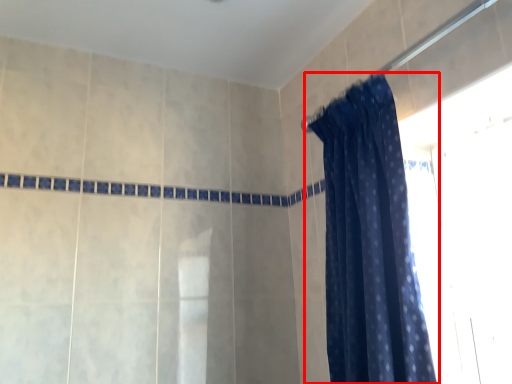
Question: From the image's perspective, where is curtain (annotated by the red box) located relative to shower?

Choices:
 (A) above
 (B) below

Answer: (B)